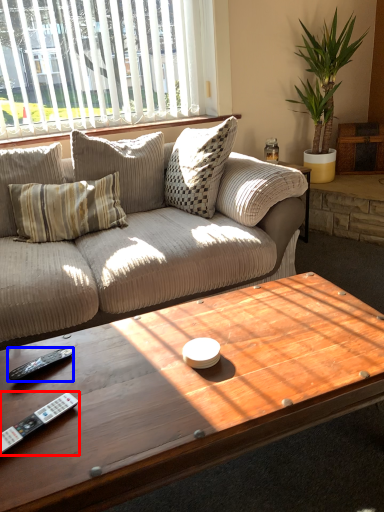
Question: Among these objects, which one is nearest to the camera, control (highlighted by a red box) or remote (highlighted by a blue box)?

Choices:
 (A) control
 (B) remote

Answer: (A)